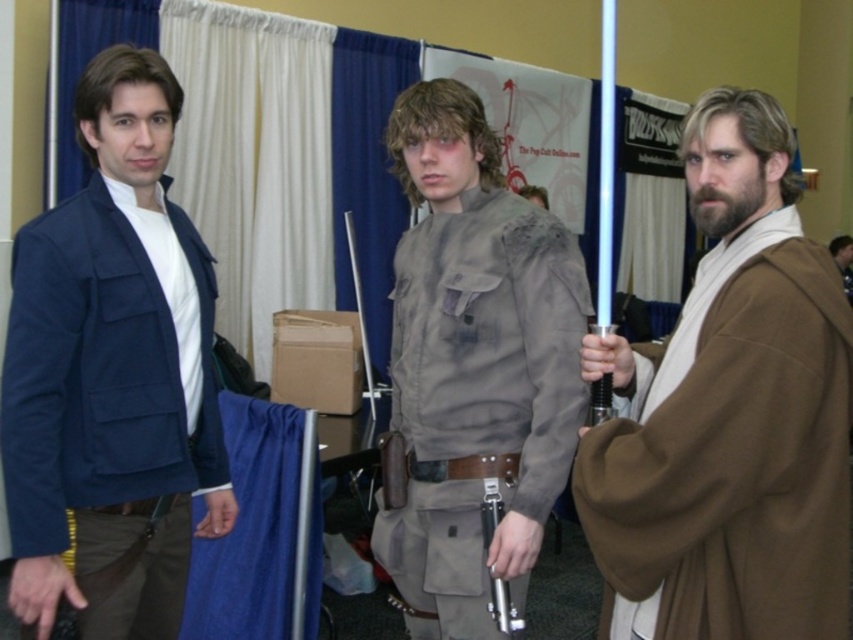
You are a photographer at the convention and want to capture a photo where both the brown cloth robe at right and the matte blue jacket at left are visible. Based on their positions, can you ensure that both will be fully visible in the frame?

The brown cloth robe at right is positioned under the matte blue jacket at left, so the robe might be partially obscured. Adjust the camera angle to ensure both are fully visible.

What is located at point (x=728, y=413)?

The brown cloth robe at right is located at point (x=728, y=413).